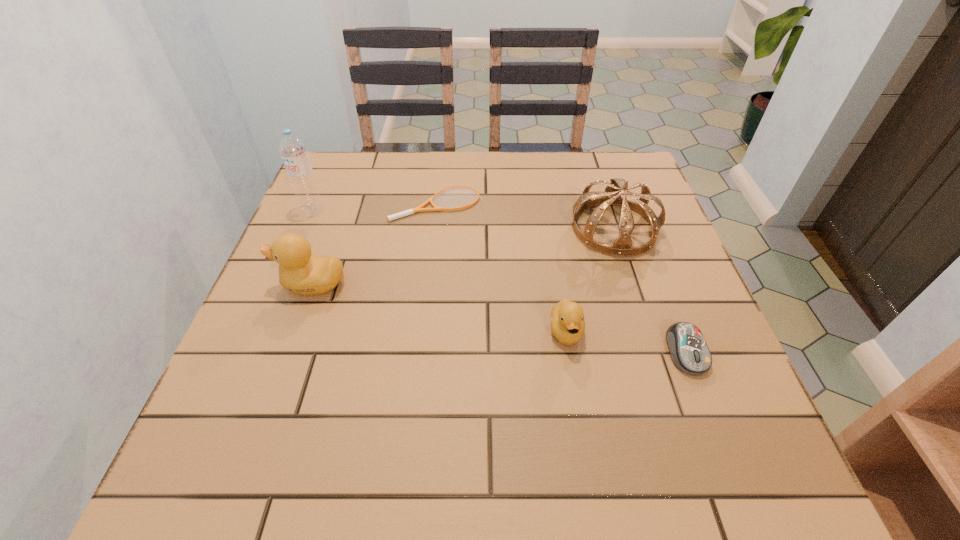
The image size is (960, 540). I want to click on the left duckling, so click(x=301, y=272).

Image resolution: width=960 pixels, height=540 pixels. I want to click on the farther duckling, so click(301, 272).

Where is `the fourth tallest object`? This screenshot has height=540, width=960. the fourth tallest object is located at coordinates (567, 322).

I want to click on the shorter duckling, so click(567, 322).

In order to click on tiara in this screenshot , I will do click(x=621, y=247).

Image resolution: width=960 pixels, height=540 pixels. What are the coordinates of `the shortest object` in the screenshot? It's located at (420, 208).

Image resolution: width=960 pixels, height=540 pixels. In order to click on tennis racket in this screenshot , I will do `click(420, 208)`.

Locate an element on the screen. the tallest object is located at coordinates (300, 173).

Identify the location of computer mouse. (688, 349).

Locate an element on the screen. free region located facing forward on the nearer duckling is located at coordinates 581,422.